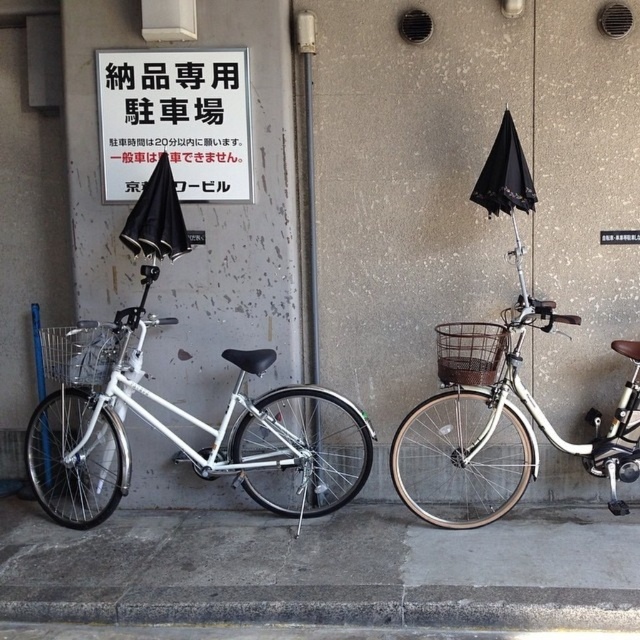
Question: Estimate the real-world distances between objects in this image. Which object is closer to the white paper sign at upper center?

Choices:
 (A) white matte bicycle at center
 (B) black matte umbrella at upper right
 (C) brown woven basket at center

Answer: (B)

Question: Is white matte bicycle at left positioned at the back of white matte bicycle at center?

Choices:
 (A) no
 (B) yes

Answer: (B)

Question: Does white matte bicycle at left have a larger size compared to black matte umbrella at left?

Choices:
 (A) no
 (B) yes

Answer: (B)

Question: Does brown woven basket at center have a lesser width compared to black matte umbrella at upper right?

Choices:
 (A) yes
 (B) no

Answer: (B)

Question: Which point appears farthest from the camera in this image?

Choices:
 (A) (177, 214)
 (B) (456, 516)

Answer: (B)

Question: Which object is positioned closest to the white matte bicycle at left?

Choices:
 (A) silver metallic basket at left
 (B) black matte umbrella at left
 (C) white paper sign at upper center
 (D) black matte umbrella at upper right

Answer: (A)